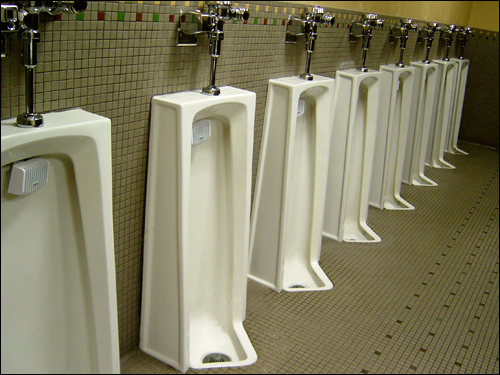
Locate an element on the screen. mens bathroom break is located at coordinates (99, 159), (177, 169), (284, 157), (345, 145), (391, 124), (421, 114), (443, 103), (461, 93).